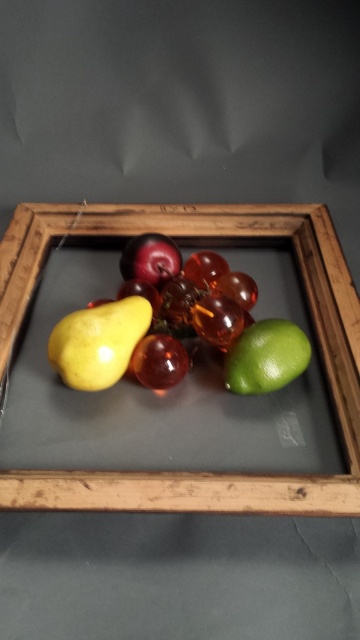
Question: Does matte glass tray at center appear under shiny red apple at center?

Choices:
 (A) yes
 (B) no

Answer: (A)

Question: Is green matte lime at lower right below shiny dark red plum at center?

Choices:
 (A) no
 (B) yes

Answer: (A)

Question: Which point is closer to the camera?

Choices:
 (A) (294, 356)
 (B) (173, 376)
 (C) (149, 305)
 (D) (155, 236)

Answer: (A)

Question: Which point is closer to the camera?

Choices:
 (A) (69, 332)
 (B) (261, 385)
 (C) (42, 209)
 (D) (123, 252)

Answer: (A)

Question: Which of the following is the closest to the observer?

Choices:
 (A) (303, 358)
 (B) (149, 248)
 (C) (29, 292)

Answer: (A)

Question: Does matte glass tray at center lie in front of shiny dark red plum at center?

Choices:
 (A) yes
 (B) no

Answer: (A)